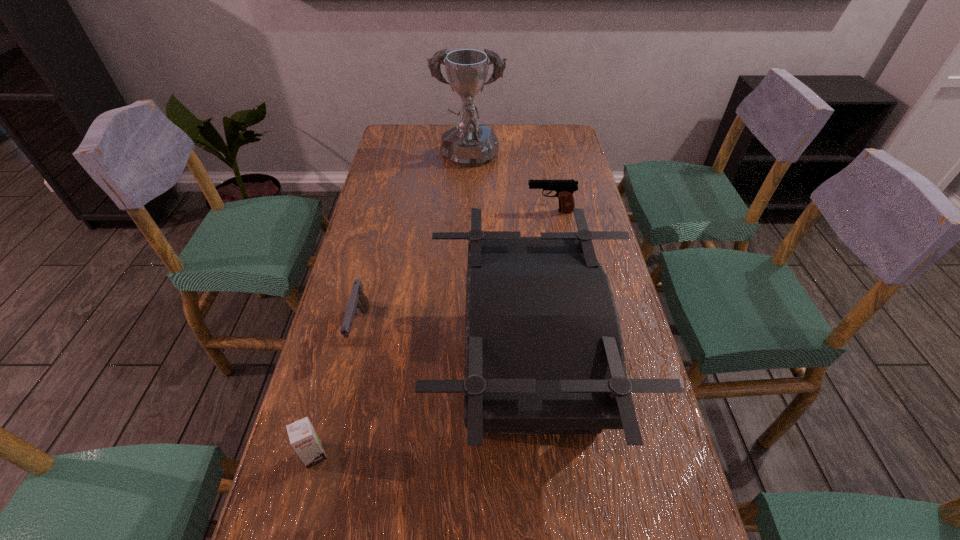
Identify the location of the tallest object. (468, 144).

The image size is (960, 540). Identify the location of award. (468, 144).

Find the location of `drone`. drone is located at coordinates (544, 354).

At what (x,y) coordinates should I click in order to perform the action: click on the right pistol. Please return your answer as a coordinate pair (x, y). Looking at the image, I should click on (564, 189).

The height and width of the screenshot is (540, 960). What are the coordinates of `the farther pistol` in the screenshot? It's located at (564, 189).

This screenshot has height=540, width=960. I want to click on chocolate milk, so click(303, 437).

Where is `the nearer pistol`? the nearer pistol is located at coordinates (x=357, y=300).

Locate an element on the screen. The width and height of the screenshot is (960, 540). free space located on the side with emblem of the tallest object is located at coordinates (468, 188).

Locate an element on the screen. vacant space located 0.060m with a camera mounted on the underside of the fourth shortest object is located at coordinates (408, 368).

Image resolution: width=960 pixels, height=540 pixels. I want to click on vacant area located 0.180m with a camera mounted on the underside of the fourth shortest object, so click(355, 368).